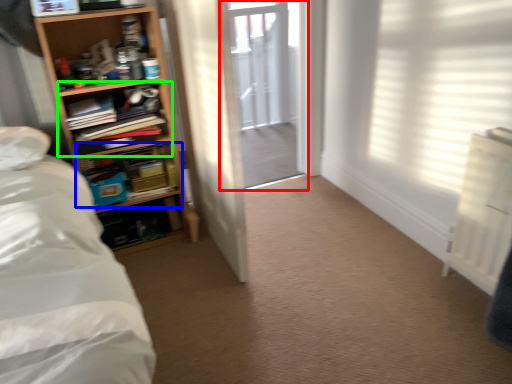
Question: Estimate the real-world distances between objects in this image. Which object is closer to screen door (highlighted by a red box), shelf (highlighted by a blue box) or shelf (highlighted by a green box)?

Choices:
 (A) shelf
 (B) shelf

Answer: (A)